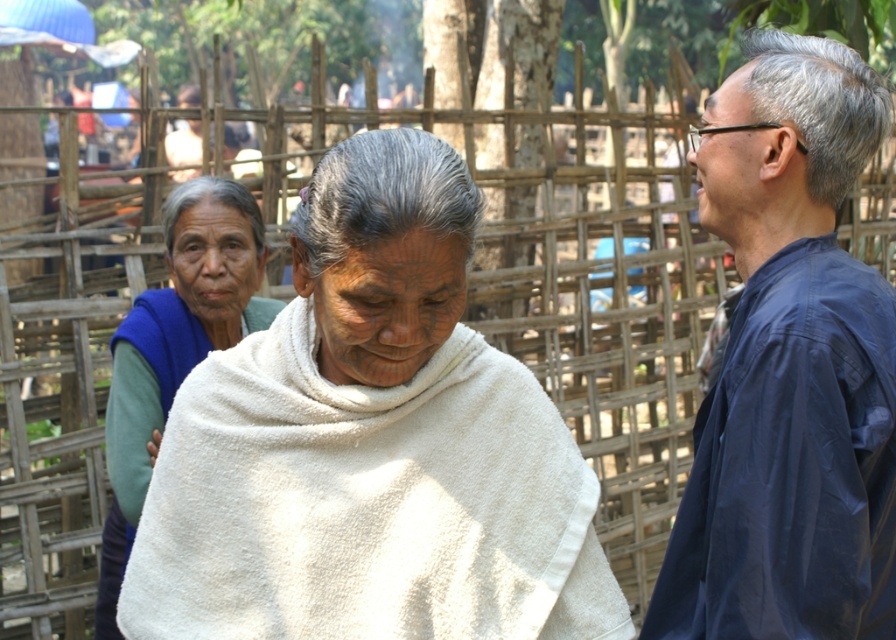
Question: Among these points, which one is farthest from the camera?

Choices:
 (A) (851, 308)
 (B) (487, 406)
 (C) (108, 561)

Answer: (C)

Question: Where is white soft cloth at center located in relation to blue fabric shirt at right in the image?

Choices:
 (A) left
 (B) right

Answer: (A)

Question: Which of the following is the closest to the observer?

Choices:
 (A) blue fleece vest at left
 (B) white soft cloth at center

Answer: (B)

Question: Is white soft cloth at center closer to camera compared to blue fabric shirt at right?

Choices:
 (A) no
 (B) yes

Answer: (A)

Question: Based on their relative distances, which object is farther from the blue fabric shirt at right?

Choices:
 (A) blue fleece vest at left
 (B) white soft cloth at center

Answer: (A)

Question: In this image, where is white soft cloth at center located relative to blue fabric shirt at right?

Choices:
 (A) right
 (B) left

Answer: (B)